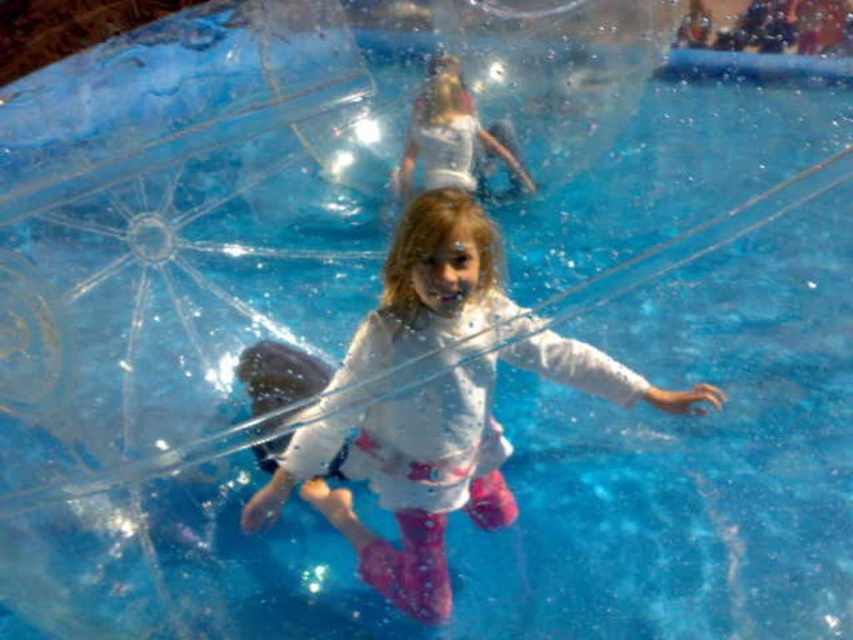
Question: Is white matte shirt at center behind white cotton shirt at upper center?

Choices:
 (A) yes
 (B) no

Answer: (B)

Question: Which point is farther from the camera taking this photo?

Choices:
 (A) (556, 362)
 (B) (461, 161)

Answer: (A)

Question: Which point is farther from the camera taking this photo?

Choices:
 (A) [384, 276]
 (B) [520, 180]

Answer: (B)

Question: Does white matte shirt at center appear on the right side of white cotton shirt at upper center?

Choices:
 (A) yes
 (B) no

Answer: (A)

Question: Does white matte shirt at center appear under white cotton shirt at upper center?

Choices:
 (A) yes
 (B) no

Answer: (A)